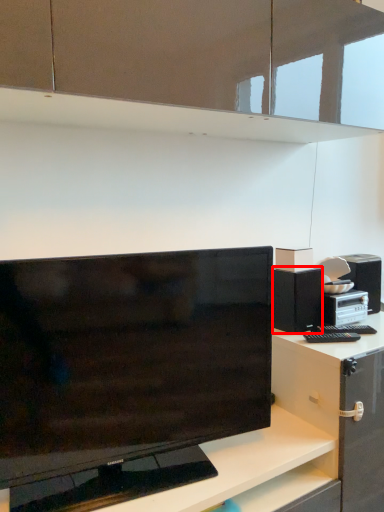
Question: From the image's perspective, where is cabinetry (annotated by the red box) located relative to desk?

Choices:
 (A) below
 (B) above

Answer: (B)